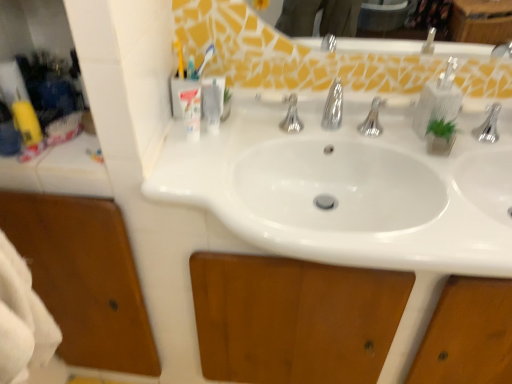
Locate an element on the screen. free point in front of clear plastic soap dispenser at upper center, the 2th toiletry positioned from the left is located at coordinates (202, 172).